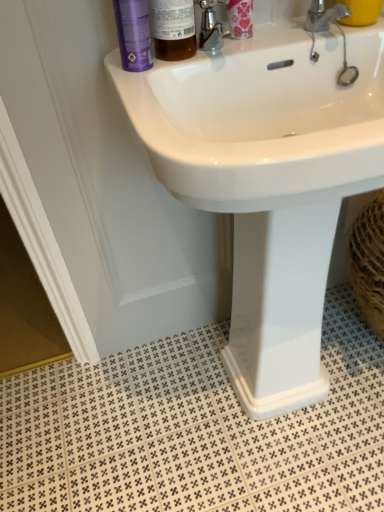
Question: Could you tell me if yellow matte cup at upper right is facing white glossy sink at upper center?

Choices:
 (A) no
 (B) yes

Answer: (A)

Question: Is yellow matte cup at upper right at the right side of white glossy sink at upper center?

Choices:
 (A) yes
 (B) no

Answer: (A)

Question: From a real-world perspective, is yellow matte cup at upper right under white glossy sink at upper center?

Choices:
 (A) yes
 (B) no

Answer: (B)

Question: Is yellow matte cup at upper right positioned with its back to white glossy sink at upper center?

Choices:
 (A) yes
 (B) no

Answer: (B)

Question: Is yellow matte cup at upper right positioned before white glossy sink at upper center?

Choices:
 (A) yes
 (B) no

Answer: (B)

Question: Is purple matte bottle at upper left bigger or smaller than white glossy sink at upper center?

Choices:
 (A) small
 (B) big

Answer: (A)

Question: In the image, is purple matte bottle at upper left positioned in front of or behind white glossy sink at upper center?

Choices:
 (A) behind
 (B) front

Answer: (A)

Question: From a real-world perspective, is purple matte bottle at upper left positioned above or below white glossy sink at upper center?

Choices:
 (A) above
 (B) below

Answer: (A)

Question: Visually, is purple matte bottle at upper left positioned to the left or to the right of white glossy sink at upper center?

Choices:
 (A) left
 (B) right

Answer: (A)

Question: Looking at the image, does purple matte bottle at upper left seem bigger or smaller compared to floral-patterned plastic container at upper center?

Choices:
 (A) big
 (B) small

Answer: (A)

Question: From the image's perspective, is purple matte bottle at upper left above or below floral-patterned plastic container at upper center?

Choices:
 (A) below
 (B) above

Answer: (A)

Question: From a real-world perspective, relative to floral-patterned plastic container at upper center, is purple matte bottle at upper left vertically above or below?

Choices:
 (A) below
 (B) above

Answer: (A)

Question: Considering the relative positions of purple matte bottle at upper left and floral-patterned plastic container at upper center in the image provided, is purple matte bottle at upper left to the left or to the right of floral-patterned plastic container at upper center?

Choices:
 (A) right
 (B) left

Answer: (B)

Question: Is yellow matte cup at upper right situated inside purple matte bottle at upper left or outside?

Choices:
 (A) inside
 (B) outside

Answer: (B)

Question: Considering the relative positions of yellow matte cup at upper right and purple matte bottle at upper left in the image provided, is yellow matte cup at upper right to the left or to the right of purple matte bottle at upper left?

Choices:
 (A) right
 (B) left

Answer: (A)